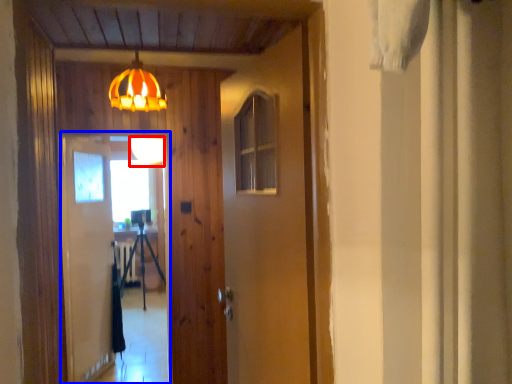
Question: Which of the following is the farthest to the observer, lamp (highlighted by a red box) or screen door (highlighted by a blue box)?

Choices:
 (A) lamp
 (B) screen door

Answer: (A)